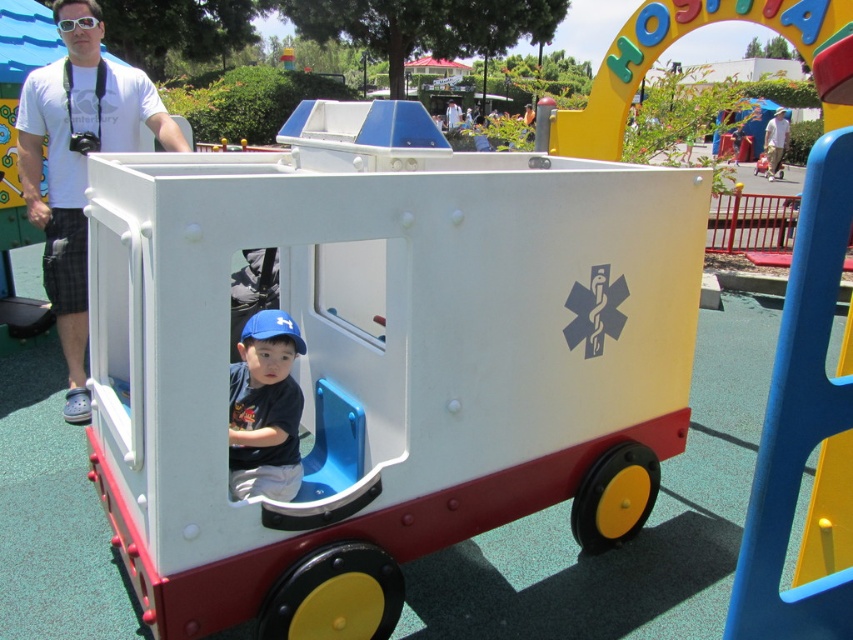
Question: Does blue matte shirt at center appear under white matte shirt at upper left?

Choices:
 (A) no
 (B) yes

Answer: (B)

Question: Is white plastic toy car at center closer to camera compared to white cotton shirt at upper right?

Choices:
 (A) no
 (B) yes

Answer: (B)

Question: Based on their relative distances, which object is nearer to the white t-shirt at upper left?

Choices:
 (A) white matte shirt at upper left
 (B) white plastic toy car at center
 (C) white cotton shirt at upper right
 (D) blue matte shirt at center

Answer: (B)

Question: Which point is closer to the camera?

Choices:
 (A) white cotton shirt at upper right
 (B) white matte shirt at upper left
 (C) white t-shirt at upper left
 (D) blue matte shirt at center

Answer: (D)

Question: Which point is farther to the camera?

Choices:
 (A) (776, 160)
 (B) (254, 408)
 (C) (125, 125)
 (D) (161, 529)

Answer: (A)

Question: Does blue matte shirt at center lie in front of white cotton shirt at upper right?

Choices:
 (A) yes
 (B) no

Answer: (A)